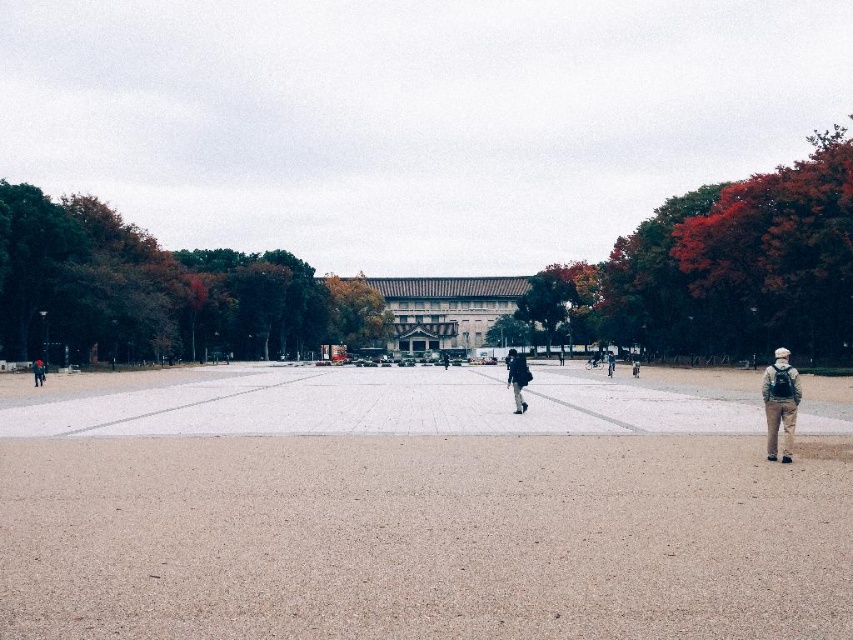
Question: Which object is the closest to the brown stone building at center?

Choices:
 (A) khaki pants at center
 (B) dark gray backpack at center

Answer: (A)

Question: Which point is farther from the camera taking this photo?

Choices:
 (A) (636, 365)
 (B) (523, 358)
 (C) (42, 362)

Answer: (A)

Question: Does brown stone building at center lie in front of khaki pants at center?

Choices:
 (A) yes
 (B) no

Answer: (B)

Question: Can you confirm if brown stone building at center is positioned above khaki pants at center?

Choices:
 (A) yes
 (B) no

Answer: (A)

Question: Which object appears farthest from the camera in this image?

Choices:
 (A) brown stone building at center
 (B) dark gray backpack at lower left
 (C) khaki pants at lower right

Answer: (A)

Question: Does dark gray backpack at lower left come behind dark gray backpack at center?

Choices:
 (A) no
 (B) yes

Answer: (A)